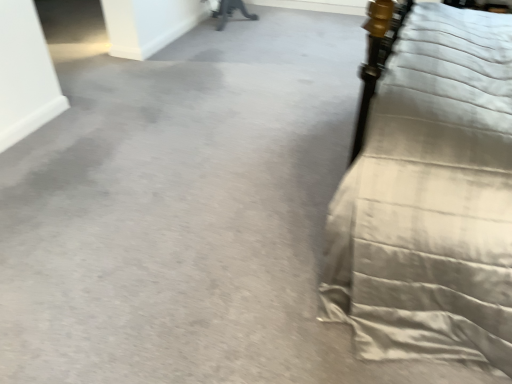
Where is `vacant region to the left of white satin bed at right`? This screenshot has width=512, height=384. vacant region to the left of white satin bed at right is located at coordinates (212, 203).